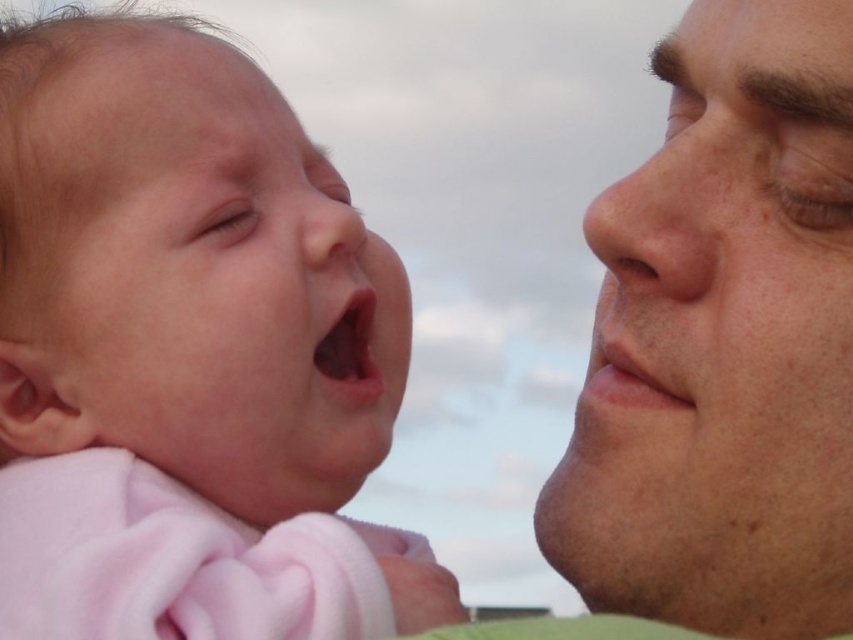
You are a photographer trying to capture a closeup shot of both the pink soft fabric baby at left and the smooth skin face at right. Since you want both subjects to be in focus, you need to adjust the camera settings. Considering their sizes, which subject should you focus on to ensure both are sharp?

The pink soft fabric baby at left is larger than the smooth skin face at right. To ensure both are in focus, you should focus on the pink soft fabric baby at left since it is the larger subject and requires a smaller aperture or greater depth of field.

You are a photographer adjusting your camera to focus on two points in the image. The first point is at coordinate point (9,458) and the second is at point (616,253). Since you can only focus on one point at a time, which point should you choose to ensure the foreground subject is in focus?

You should focus on point (9,458) because it is closer to the viewer than point (616,253), ensuring the foreground subject remains sharp.

You are a photographer trying to capture a closeup shot of both the pink soft fabric baby at left and the smooth skin nose at right. Based on their positions and sizes, can you fit both subjects into the frame without zooming in or out?

The pink soft fabric baby at left might be wider than smooth skin nose at right, so it is uncertain if both can fit into the frame without adjusting the zoom. Consider experimenting with different angles or zoom levels to ensure both are visible.